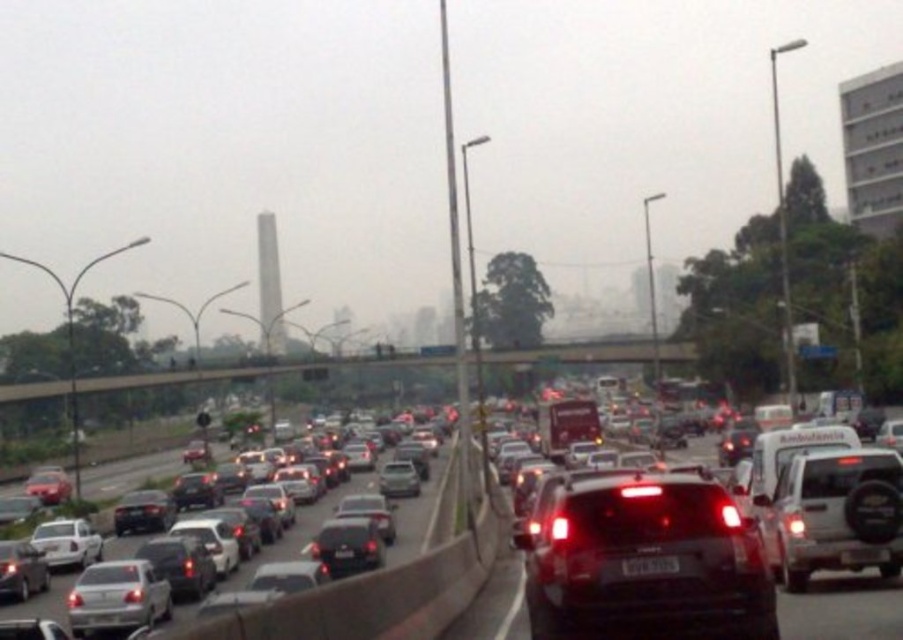
Who is more distant from viewer, (578, 618) or (780, 620)?

Positioned behind is point (780, 620).

Between satin black suv at center and metallic cars at center, which one is positioned lower?

metallic cars at center

Identify the location of satin black suv at center. This screenshot has height=640, width=903. (643, 556).

Is point (838, 589) positioned before point (629, 557)?

No, (838, 589) is further to viewer.

Does metallic cars at center come in front of black plastic license plate at center?

No, it is not.

This screenshot has height=640, width=903. What are the coordinates of `metallic cars at center` in the screenshot? It's located at (843, 609).

This screenshot has width=903, height=640. What do you see at coordinates (643, 556) in the screenshot?
I see `satin black suv at center` at bounding box center [643, 556].

Which is behind, point (557, 493) or point (48, 612)?

The point (48, 612) is more distant.

At what (x,y) coordinates should I click in order to perform the action: click on satin black suv at center. Please return your answer as a coordinate pair (x, y). Looking at the image, I should click on (643, 556).